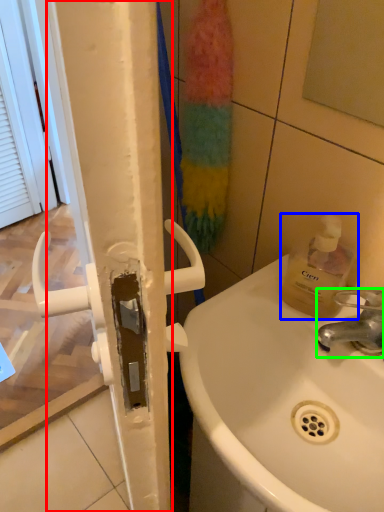
Question: Which is nearer to the shower door (highlighted by a red box)? bottle (highlighted by a blue box) or tap (highlighted by a green box).

Choices:
 (A) bottle
 (B) tap

Answer: (B)